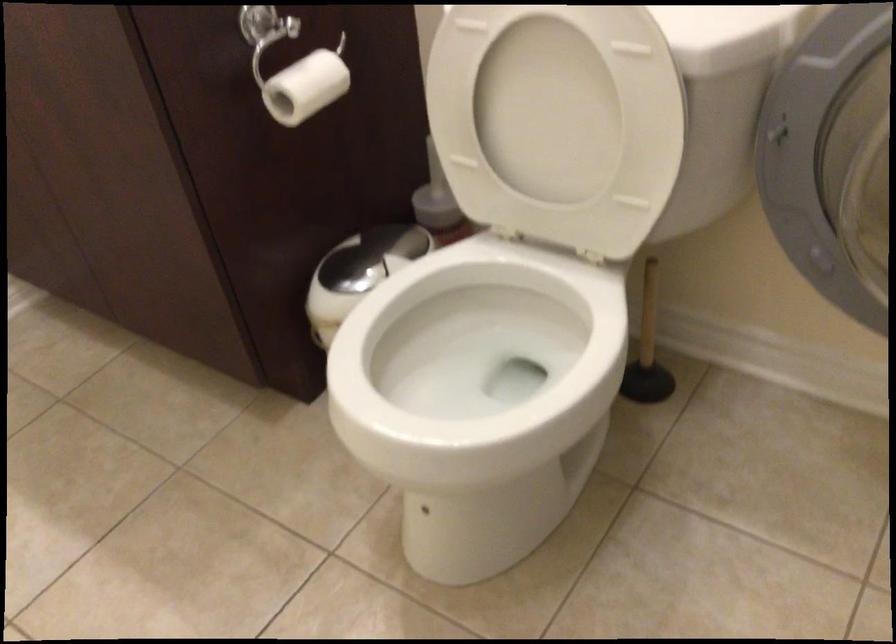
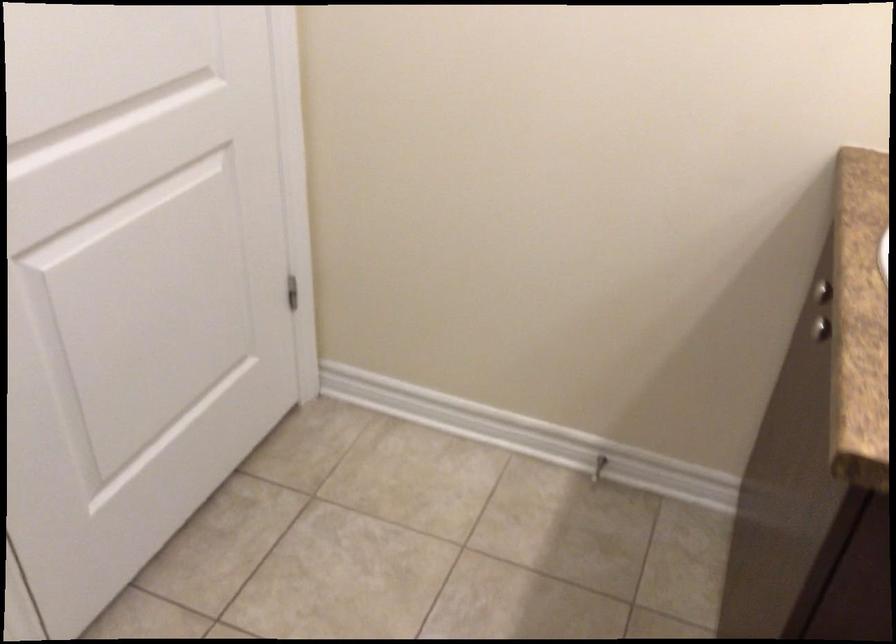
The images are taken continuously from a first-person perspective. In which direction is your viewpoint rotating?

The rotation direction of the camera is left-down.